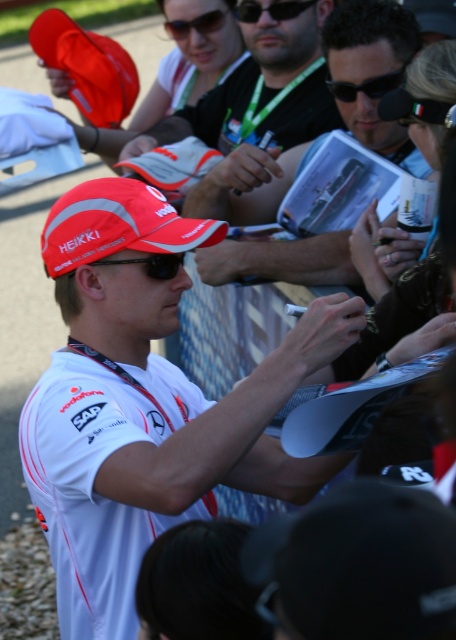
Question: Which point is closer to the camera taking this photo?

Choices:
 (A) (271, 10)
 (B) (381, 17)
 (C) (177, 260)

Answer: (C)

Question: Is white matte shirt at center closer to the viewer compared to white matte cap at center?

Choices:
 (A) yes
 (B) no

Answer: (A)

Question: Which point is closer to the camera taking this photo?

Choices:
 (A) (190, 26)
 (B) (98, 259)

Answer: (B)

Question: Does white matte shirt at center have a smaller size compared to red fabric cap at center?

Choices:
 (A) yes
 (B) no

Answer: (B)

Question: Does red fabric cap at center have a smaller size compared to black plastic goggles at center?

Choices:
 (A) yes
 (B) no

Answer: (B)

Question: Which point is closer to the camera?

Choices:
 (A) (140, 262)
 (B) (207, 93)
 (C) (247, 420)

Answer: (C)